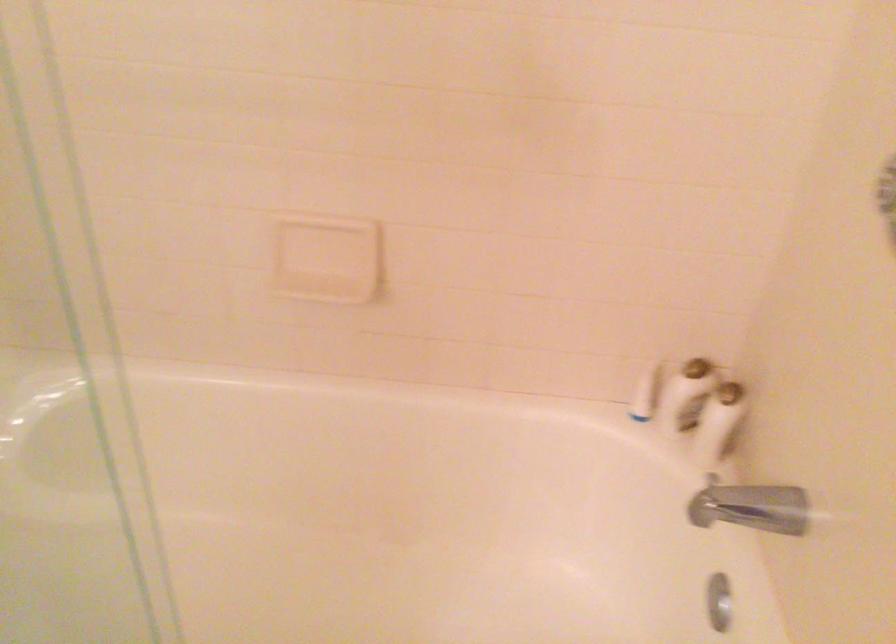
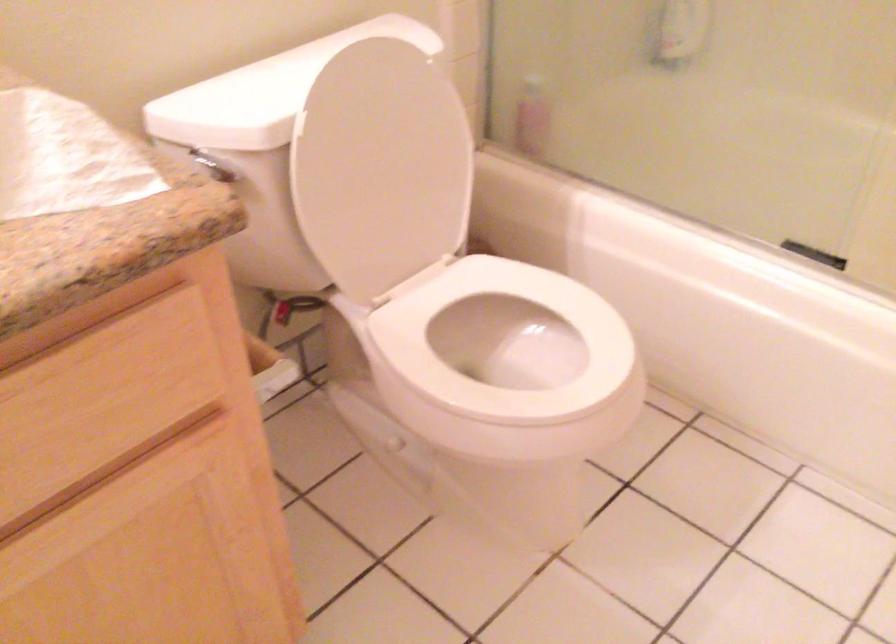
Question: The first image is from the beginning of the video and the second image is from the end. How did the camera likely rotate when shooting the video?

Choices:
 (A) Left
 (B) Right
 (C) Up
 (D) Down

Answer: (A)